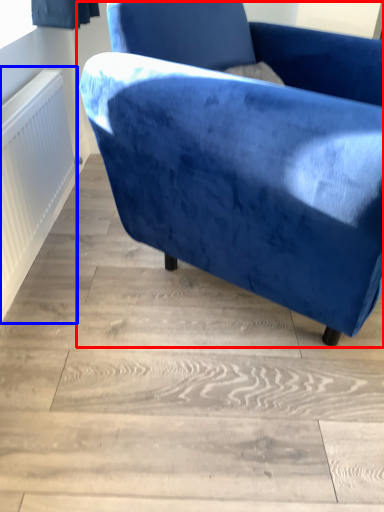
Question: Which point is closer to the camera, chair (highlighted by a red box) or radiator (highlighted by a blue box)?

Choices:
 (A) chair
 (B) radiator

Answer: (A)